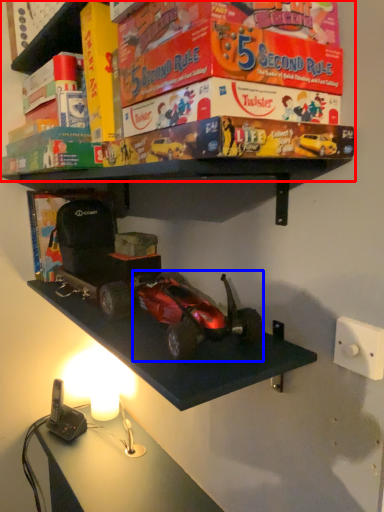
Question: Among these objects, which one is nearest to the camera, shelf (highlighted by a red box) or model car (highlighted by a blue box)?

Choices:
 (A) shelf
 (B) model car

Answer: (A)